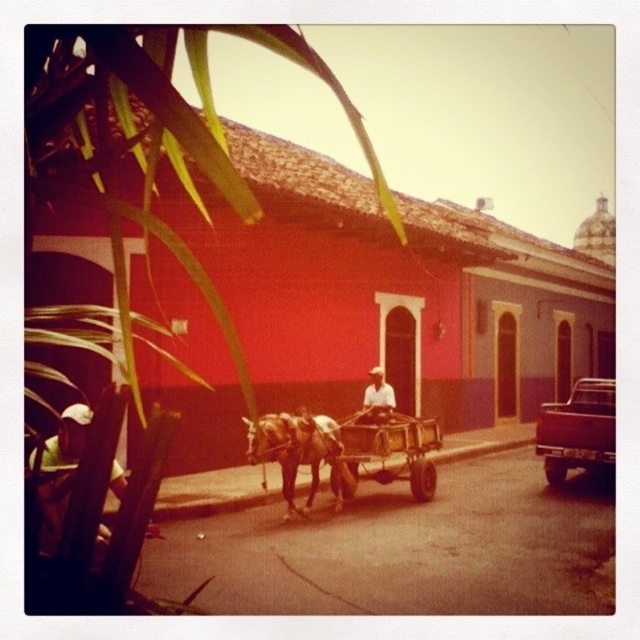
You are standing on the street and see the green fabric hat at lower left and the white clothed person at center. Which object is located to the left of the other?

The green fabric hat at lower left is positioned on the left side of white clothed person at center.

What is the 2D coordinate of the wooden cart at center?

The wooden cart at center is located at the 2D coordinate point of (388, 449).

You are a tourist in this Latin American town and want to take a photo of the wooden cart at center without the green fabric hat at lower left blocking it. How should you adjust your position?

The wooden cart at center is positioned under the green fabric hat at lower left, so to avoid the hat blocking the view, you should move to the right side of the cart.